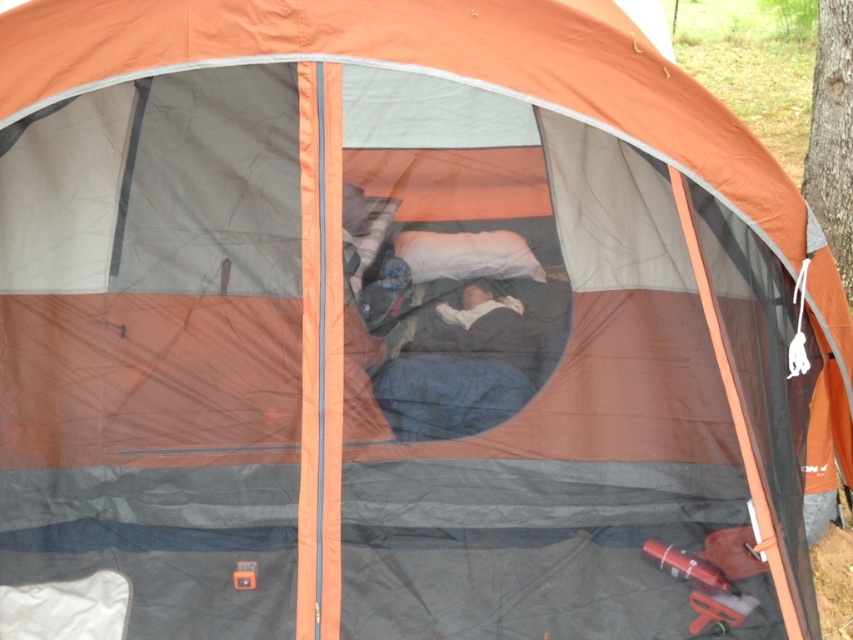
Question: Which object is farther from the camera taking this photo?

Choices:
 (A) white soft pillow at center
 (B) dark blue sleeping bag at center

Answer: (A)

Question: Does dark blue sleeping bag at center appear on the right side of white soft pillow at center?

Choices:
 (A) yes
 (B) no

Answer: (B)

Question: Among these points, which one is nearest to the camera?

Choices:
 (A) (495, 378)
 (B) (422, 230)

Answer: (A)

Question: Does dark blue sleeping bag at center have a greater width compared to white soft pillow at center?

Choices:
 (A) yes
 (B) no

Answer: (A)

Question: From the image, what is the correct spatial relationship of dark blue sleeping bag at center in relation to white soft pillow at center?

Choices:
 (A) below
 (B) above

Answer: (A)

Question: Which point is farther from the camera taking this photo?

Choices:
 (A) (396, 246)
 (B) (482, 396)

Answer: (A)